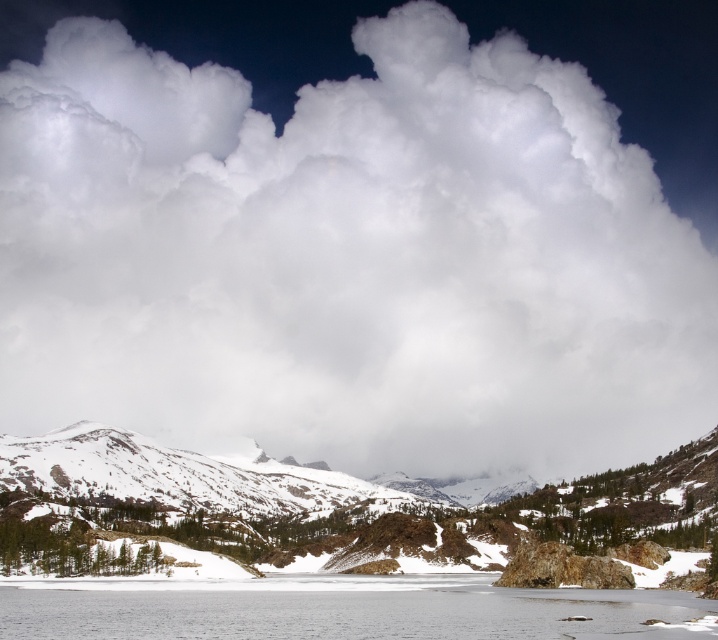
You are a photographer planning to capture the snowy granite mountain at lower left and the clear ice water at lower center in a single frame. Given that your camera can only accommodate one of the two in full view, which object should you prioritize to ensure it fits entirely within the frame?

The snowy granite mountain at lower left should be prioritized because its width surpasses that of the clear ice water at lower center, meaning it requires more space to be fully captured.

In the scene shown: You are a hiker planning to cross the clear ice water at lower center to reach the snowy granite mountain at lower left. Considering their sizes, which one do you think is bigger?

The snowy granite mountain at lower left has a larger size compared to clear ice water at lower center, so the snowy granite mountain at lower left is bigger.

You are standing at the center of the image and want to reach the snowy granite mountain at lower left. Which direction should you move in to get there?

To reach the snowy granite mountain at lower left, you should move towards the lower left direction from your current position at the center of the image.